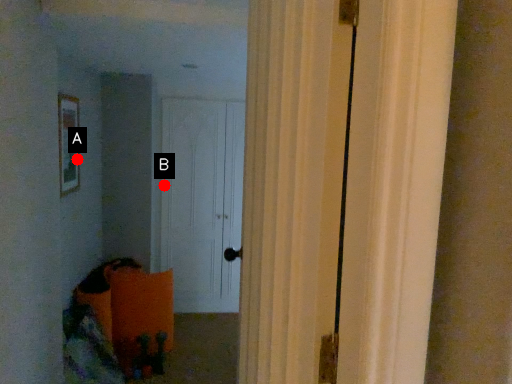
Question: Two points are circled on the image, labeled by A and B beside each circle. Which point is closer to the camera taking this photo?

Choices:
 (A) A is closer
 (B) B is closer

Answer: (A)